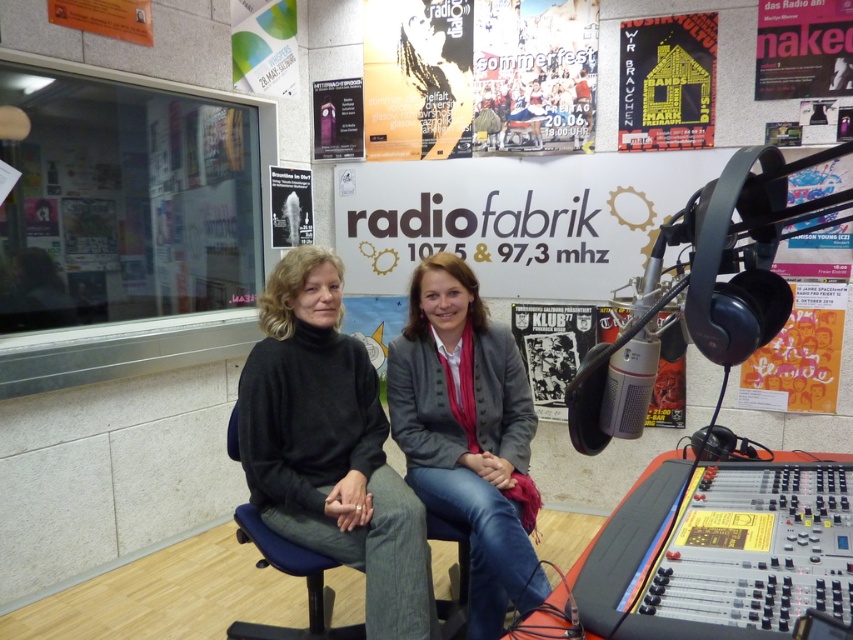
You are an interior designer assessing the wall decorations in a radio studio. You notice the yellow paper house at upper right and the white paper poster at upper left. Which decoration is wider?

The yellow paper house at upper right is wider than the white paper poster at upper left.

From the picture: You are a guest speaker in the radio studio and need to choose between two microphone positions marked by point coordinates. The first is at point (508,520) and the second is at point (618,106). Which point is closer to the front of the studio?

Point (508,520) is in front of point (618,106), so the first point is closer to the front of the studio.